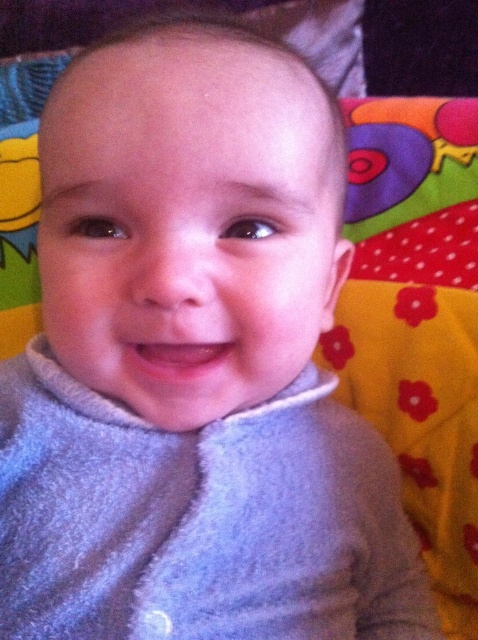
Consider the image. Based on the scene description, can you determine which object is positioned higher between the gray soft baby at center and the gray fleece sweater at center?

The gray soft baby at center is located above the gray fleece sweater at center, so the gray soft baby at center is positioned higher.

You are a photographer trying to capture the baby in the image. You want to ensure the gray soft baby at center and the gray fleece sweater at center are both visible in the frame. Which object should you adjust your camera angle to focus on first to include both?

The gray soft baby at center is positioned on the left side of the gray fleece sweater at center. To include both in the frame, focus on the gray soft baby at center first as it is on the left, then adjust to ensure the gray fleece sweater at center is also in view.